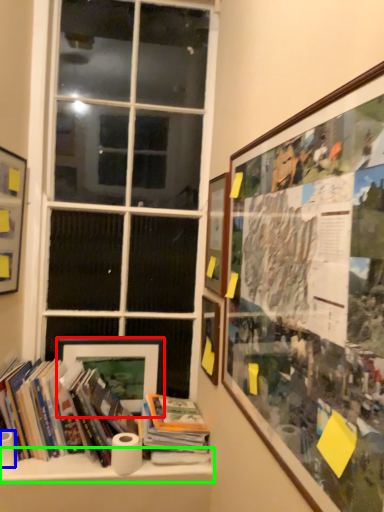
Question: Based on their relative distances, which object is nearer to picture frame (highlighted by a red box)? Choose from paper towel (highlighted by a blue box) and window sill (highlighted by a green box).

Choices:
 (A) paper towel
 (B) window sill

Answer: (B)